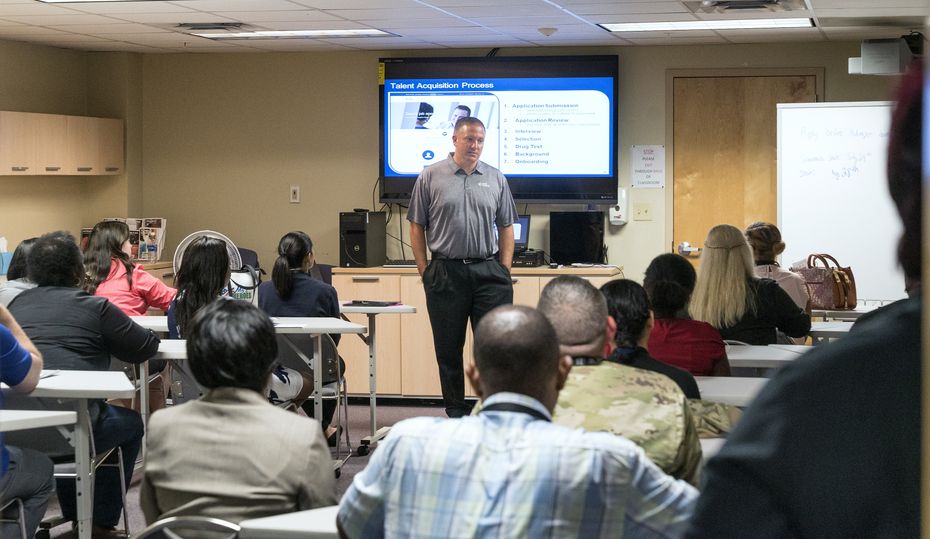
You are a GUI agent. You are given a task and a screenshot of the screen. Output one action in this format:
    pyautogui.click(x=<x>, y=<y>)
    Task: Click on the door
    The height and width of the screenshot is (539, 930).
    Given the screenshot: What is the action you would take?
    pyautogui.click(x=707, y=177)